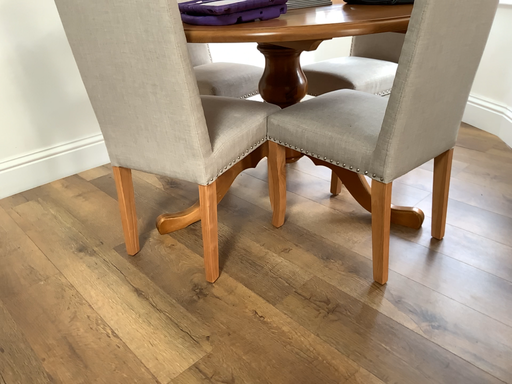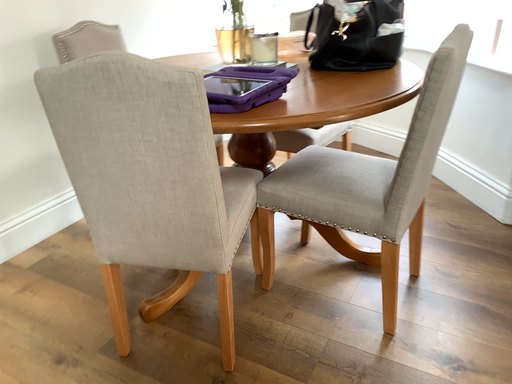
Question: How did the camera likely rotate when shooting the video?

Choices:
 (A) rotated left
 (B) rotated right

Answer: (B)